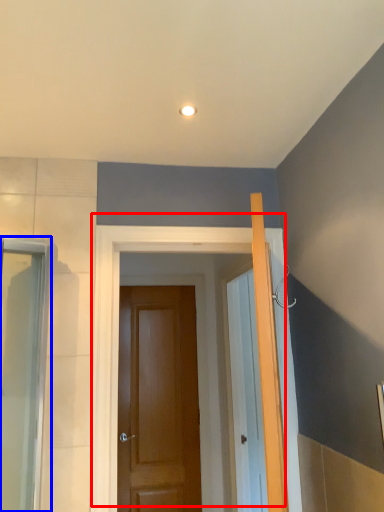
Question: Which object appears farthest to the camera in this image, door (highlighted by a red box) or screen door (highlighted by a blue box)?

Choices:
 (A) door
 (B) screen door

Answer: (A)